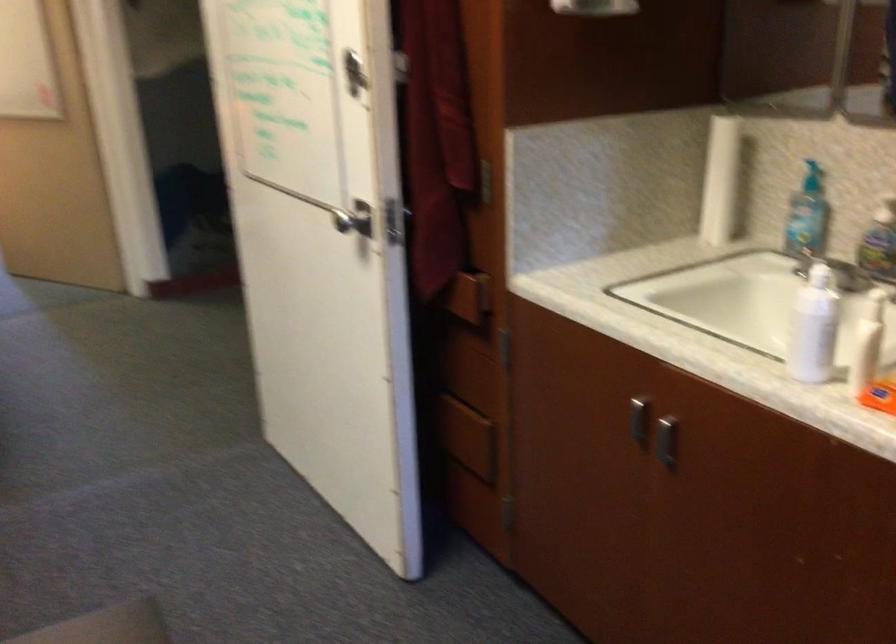
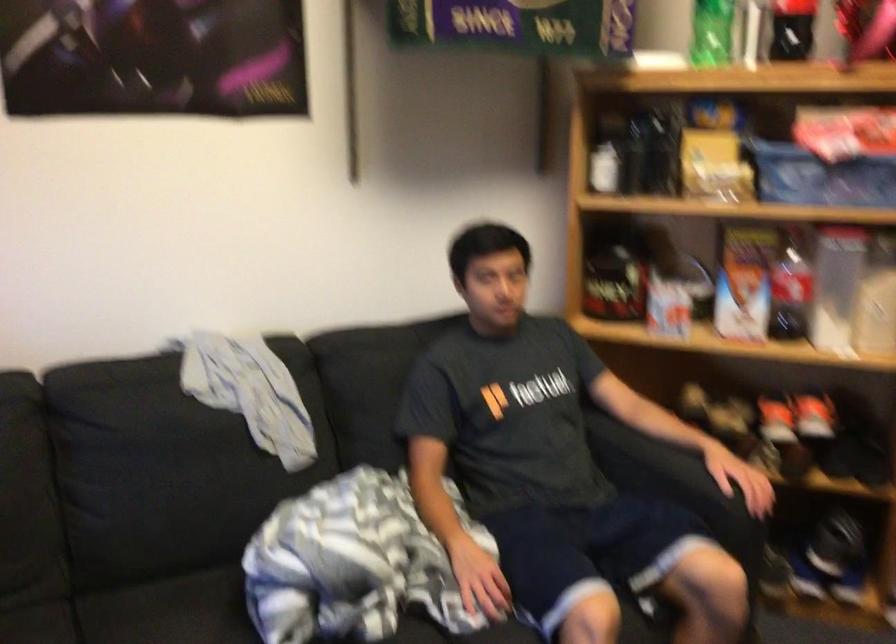
How did the camera likely rotate?

The rotation direction of the camera is left-down.